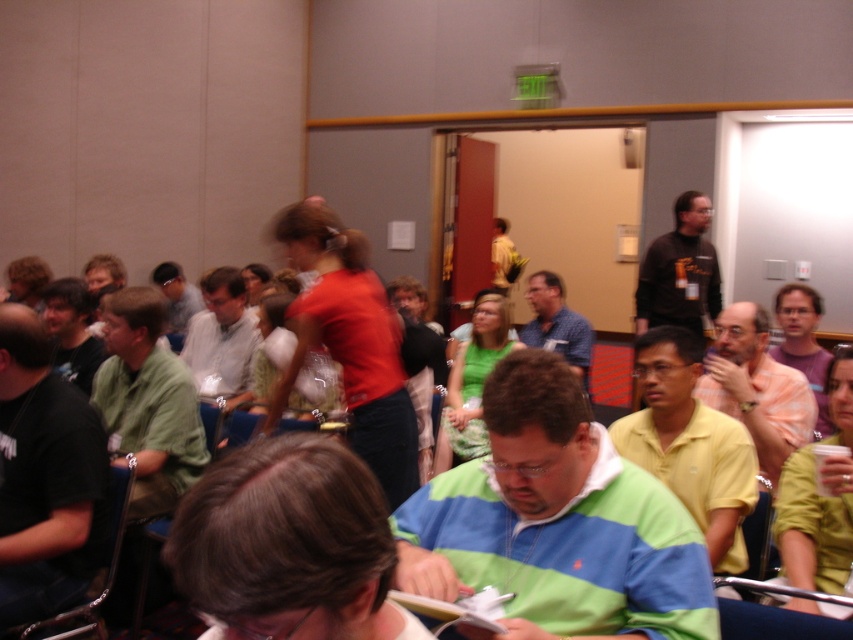
In the conference room scene, there are two people wearing green matte shirt at left and purple matte shirt at center. Which one is taller?

The green matte shirt at left is taller than the purple matte shirt at center.

You are sitting in the back row of the conference room and want to hand a note to both the green matte shirt at left and the purple matte shirt at center. Which person should you approach first to reach them in the shortest path?

You should approach the green matte shirt at left first because it is closer to you than the purple matte shirt at center, so the shortest path would be to reach the green matte shirt at left first.